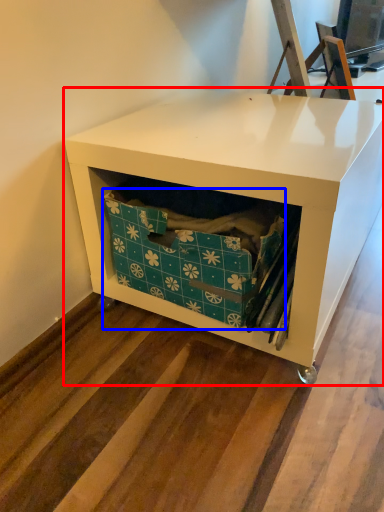
Question: Among these objects, which one is farthest to the camera, furniture (highlighted by a red box) or storage box (highlighted by a blue box)?

Choices:
 (A) furniture
 (B) storage box

Answer: (B)